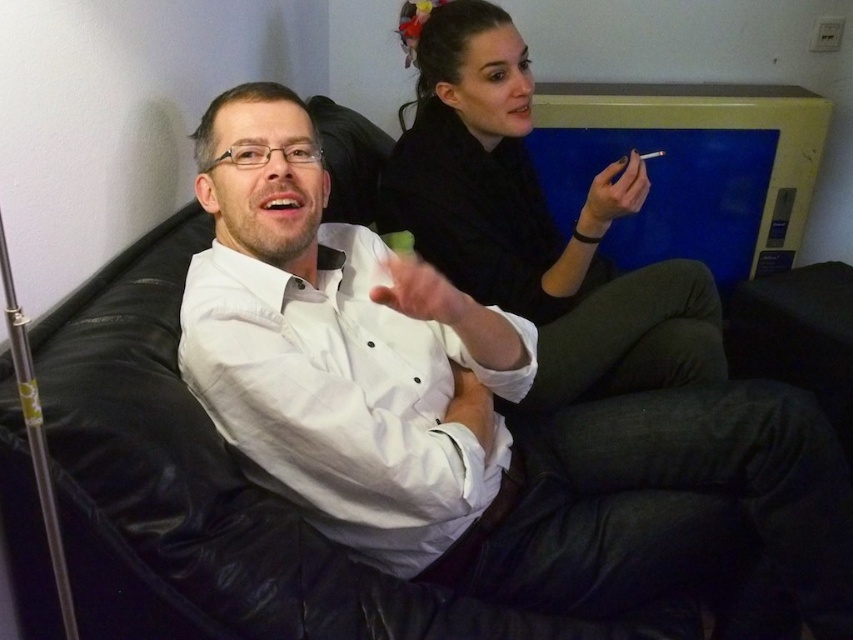
The height and width of the screenshot is (640, 853). In order to click on black matte shirt at upper right in this screenshot , I will do `click(537, 225)`.

Locate an element on the screen. The height and width of the screenshot is (640, 853). white matte shirt at center is located at coordinates 477,408.

Measure the distance between point (x=364, y=474) and camera.

Point (x=364, y=474) is 90.53 centimeters away from camera.

Where is `white matte shirt at center`? The width and height of the screenshot is (853, 640). white matte shirt at center is located at coordinates (477, 408).

Is white matte shirt at center smaller than matte white cigarette at upper center?

No, white matte shirt at center is not smaller than matte white cigarette at upper center.

Which is below, white matte shirt at center or matte white cigarette at upper center?

white matte shirt at center

What do you see at coordinates (477, 408) in the screenshot? I see `white matte shirt at center` at bounding box center [477, 408].

The width and height of the screenshot is (853, 640). Find the location of `white matte shirt at center`. white matte shirt at center is located at coordinates (477, 408).